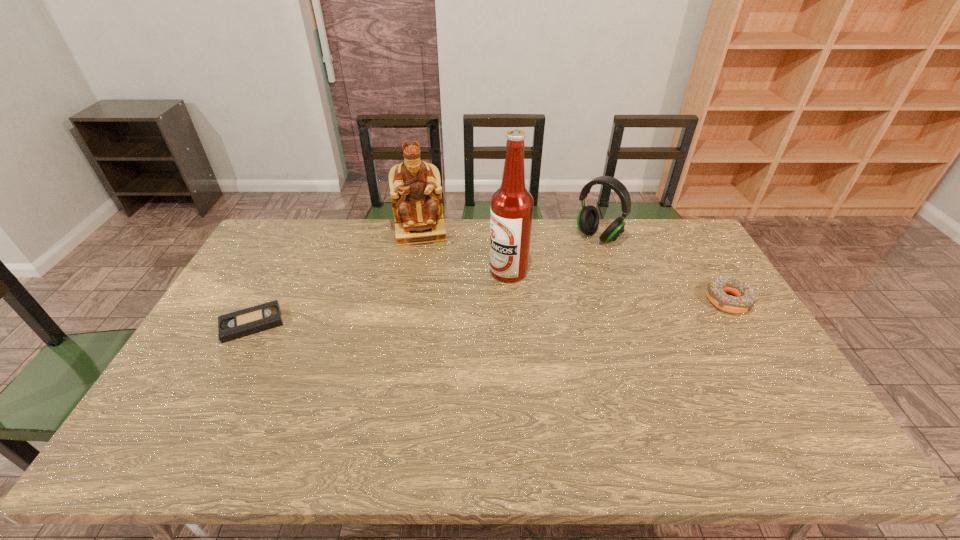
In order to click on object that is the second closest to the headset in this screenshot , I will do `click(745, 298)`.

Identify the location of free location that satisfies the following two spatial constraints: 1. on the back side of the headset; 2. on the left side of the leftmost object. The width and height of the screenshot is (960, 540). (298, 237).

Identify the location of free space in the image that satisfies the following two spatial constraints: 1. on the back side of the fourth object from left to right; 2. on the right side of the leftmost object. The height and width of the screenshot is (540, 960). (298, 237).

Where is `free region that satisfies the following two spatial constraints: 1. on the front side of the second object from right to left; 2. on the right side of the fourth object from right to left`? This screenshot has height=540, width=960. free region that satisfies the following two spatial constraints: 1. on the front side of the second object from right to left; 2. on the right side of the fourth object from right to left is located at coordinates (420, 237).